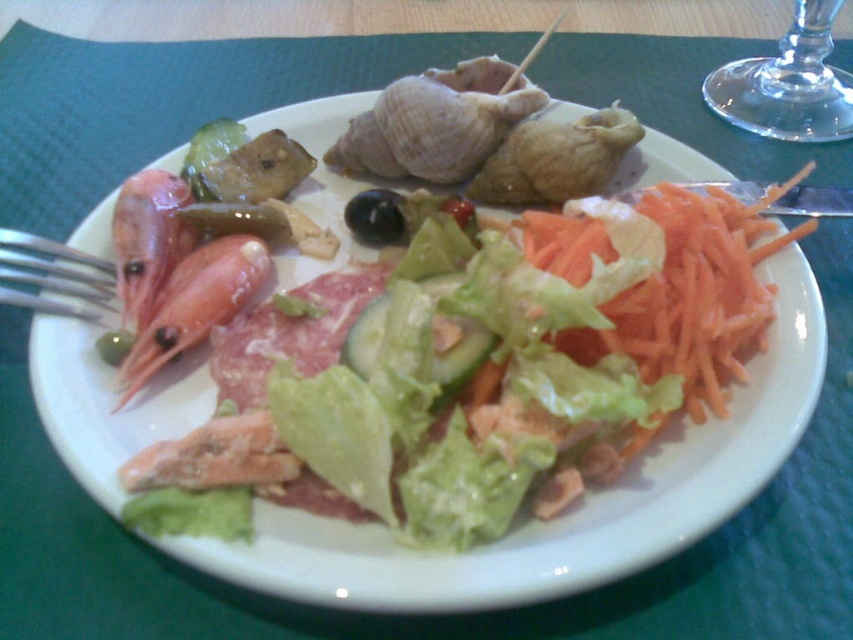
In the scene shown: You are a server in a restaurant and need to place a 15 inch long bottle on the table. You see the transparent glass at upper right and the black glossy olive at center. Is there enough space between them to fit the bottle?

The distance between the transparent glass at upper right and the black glossy olive at center is 14.64 inches, which is slightly shorter than the 15 inch bottle. Therefore, the bottle may not fit comfortably between them.